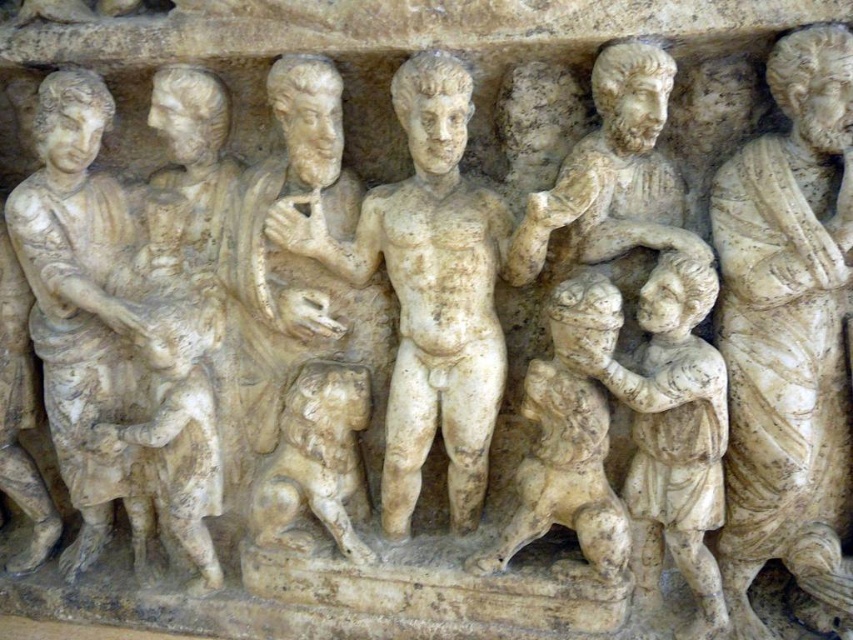
You are a tour guide standing 1.5 meters away from the relief sculpture. You want to ensure visitors can view the white marble statue at center clearly. Is the statue within a comfortable viewing distance for most adults?

The white marble statue at center is 1.20 meters from the viewer, which means it is within a comfortable viewing distance for most adults since it is only 0.3 meters closer than your position. Visitors should have no difficulty seeing it clearly.

Looking at the relief sculpture, where is the white marble child at center in relation to the white stone lion at lower left?

The white marble child at center is to the right of the white stone lion at lower left.

You are standing in front of the relief sculpture and want to touch the point at coordinate point (776, 212). If your hand can reach up to 1.2 meters, will you be able to reach it?

The point at coordinate point (776, 212) is 1.22 meters away from the viewer. Since your hand can only reach up to 1.2 meters, you will not be able to reach it.